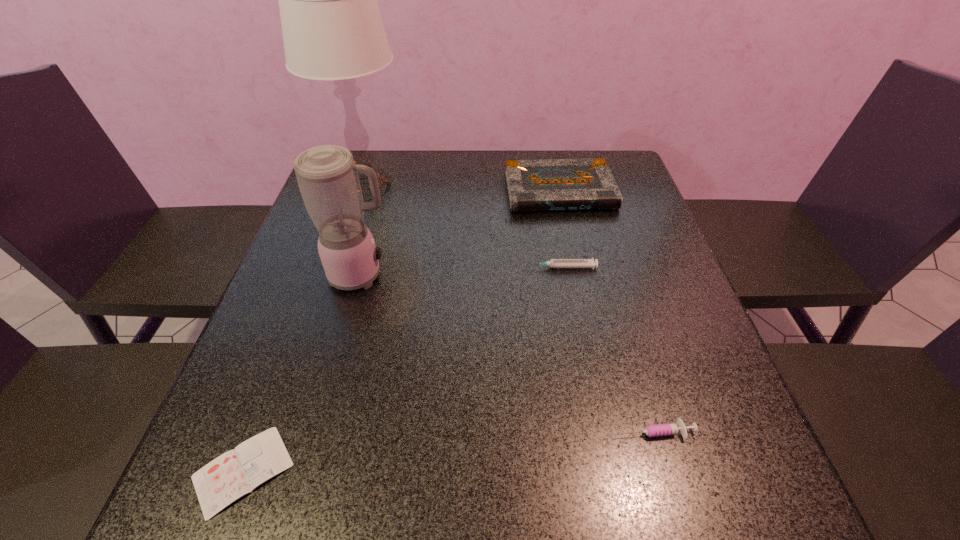
Locate an element on the screen. The width and height of the screenshot is (960, 540). vacant area that satisfies the following two spatial constraints: 1. on the front-facing side of the tallest object; 2. on the right side of the fourth shortest object is located at coordinates (367, 191).

Where is `free location that satisfies the following two spatial constraints: 1. on the front-facing side of the table lamp; 2. on the back side of the fourth shortest object`? free location that satisfies the following two spatial constraints: 1. on the front-facing side of the table lamp; 2. on the back side of the fourth shortest object is located at coordinates (367, 191).

Find the location of a particular element. This screenshot has height=540, width=960. vacant space that satisfies the following two spatial constraints: 1. at the needle end of the farther syringe; 2. on the left side of the nearer syringe is located at coordinates tap(592, 431).